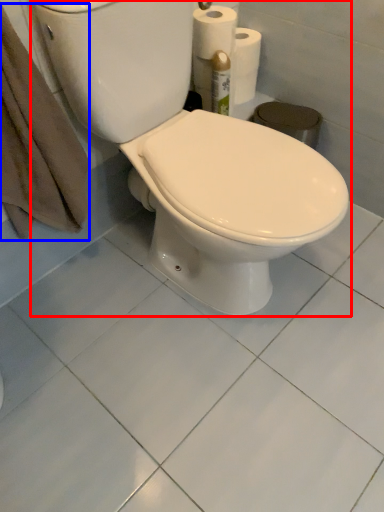
Question: Which object is closer to the camera taking this photo, toilet (highlighted by a red box) or bath towel (highlighted by a blue box)?

Choices:
 (A) toilet
 (B) bath towel

Answer: (A)